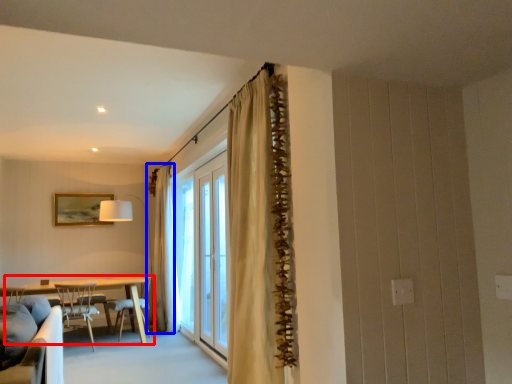
Question: Which of the following is the farthest to the observer, kitchen & dining room table (highlighted by a red box) or curtain (highlighted by a blue box)?

Choices:
 (A) kitchen & dining room table
 (B) curtain

Answer: (B)